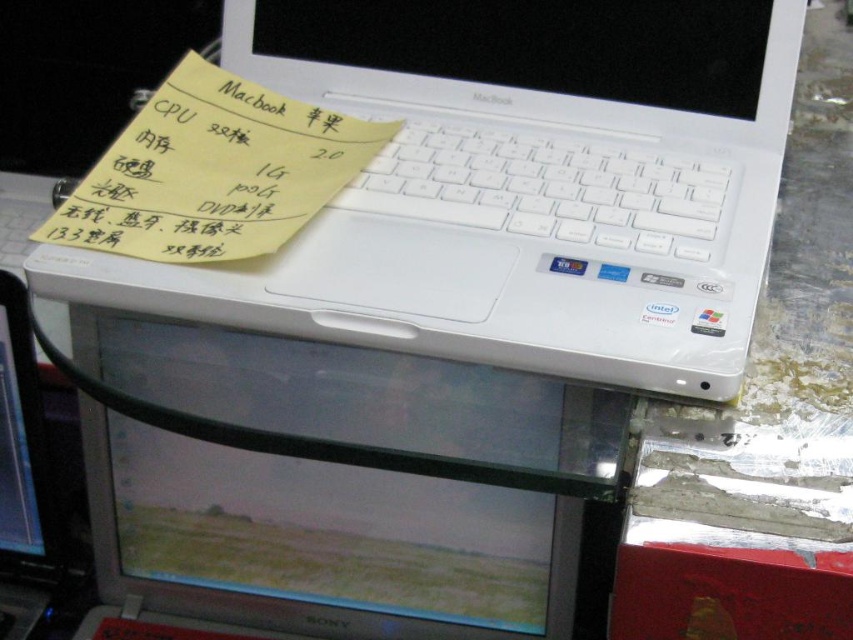
You are taking a photo of the MacBook laptop and want to focus on a specific point. If you have to choose between point 1 at position point (241,355) and point 2 at position point (22,522), which point should you focus on to ensure it appears clearer in the photo?

You should focus on point (241,355) because it is closer to the camera than point (22,522), so it will appear clearer in the photo.

You are a technician who needs to place a new component between the white plastic laptop at upper center and the yellow paper at upper left. The component requires 12 centimeters of space. Based on the scene, can you fit it there?

The distance between the white plastic laptop at upper center and the yellow paper at upper left is 10.56 centimeters, which is less than the required 12 centimeters. Therefore, the component cannot be placed there.